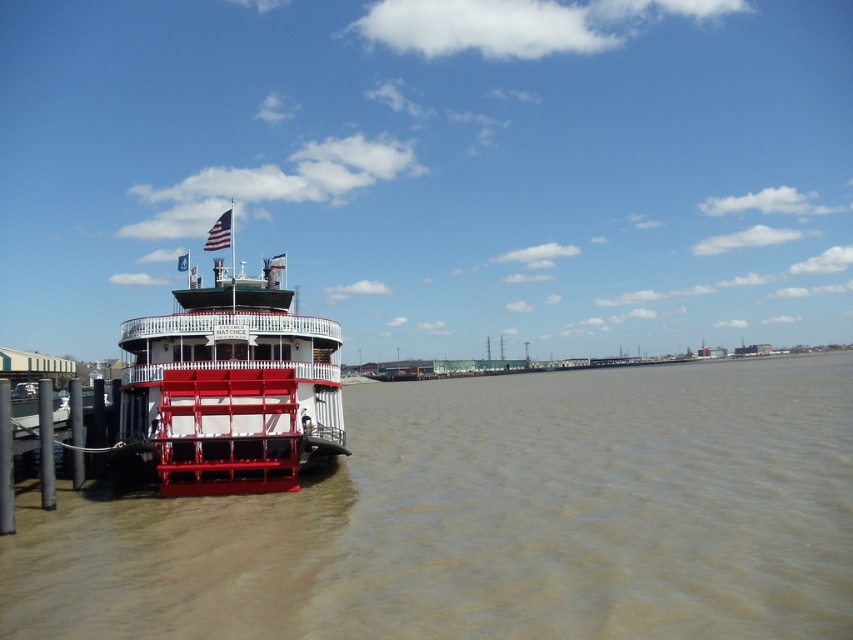
Question: Is brown matte water at lower left below white matte paddlewheel boat at left?

Choices:
 (A) no
 (B) yes

Answer: (B)

Question: Does white matte paddlewheel boat at left come behind american flag at upper left?

Choices:
 (A) yes
 (B) no

Answer: (B)

Question: Observing the image, what is the correct spatial positioning of brown matte water at lower left in reference to white matte paddlewheel boat at left?

Choices:
 (A) below
 (B) above

Answer: (A)

Question: Based on their relative distances, which object is nearer to the brown matte water at lower left?

Choices:
 (A) american flag at upper left
 (B) white matte paddlewheel boat at left

Answer: (B)

Question: Which object appears closest to the camera in this image?

Choices:
 (A) american flag at upper left
 (B) white matte paddlewheel boat at left

Answer: (B)

Question: Among these objects, which one is nearest to the camera?

Choices:
 (A) american flag at upper left
 (B) white matte paddlewheel boat at left
 (C) brown matte water at lower left

Answer: (C)